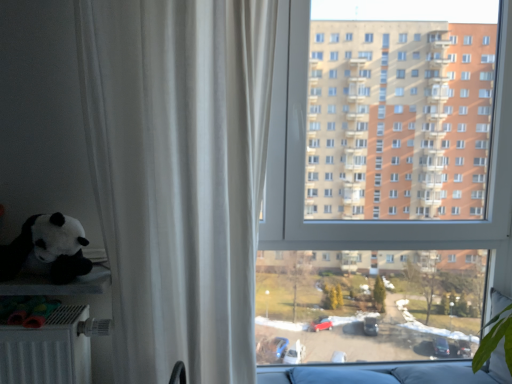
Question: From the image's perspective, is white sheer curtain at left under matte black plush panda at left?

Choices:
 (A) yes
 (B) no

Answer: (B)

Question: Can you confirm if white sheer curtain at left is bigger than matte black plush panda at left?

Choices:
 (A) yes
 (B) no

Answer: (A)

Question: Is white sheer curtain at left directly adjacent to matte black plush panda at left?

Choices:
 (A) no
 (B) yes

Answer: (A)

Question: Is white sheer curtain at left to the left of matte black plush panda at left from the viewer's perspective?

Choices:
 (A) yes
 (B) no

Answer: (B)

Question: Can we say white sheer curtain at left lies outside matte black plush panda at left?

Choices:
 (A) yes
 (B) no

Answer: (A)

Question: Considering the positions of white sheer curtain at left and matte black plush panda at left in the image, is white sheer curtain at left taller or shorter than matte black plush panda at left?

Choices:
 (A) tall
 (B) short

Answer: (A)

Question: Looking at the image, does white sheer curtain at left seem bigger or smaller compared to matte black plush panda at left?

Choices:
 (A) big
 (B) small

Answer: (A)

Question: Is white sheer curtain at left inside or outside of matte black plush panda at left?

Choices:
 (A) outside
 (B) inside

Answer: (A)

Question: From the image's perspective, relative to matte black plush panda at left, is white sheer curtain at left above or below?

Choices:
 (A) above
 (B) below

Answer: (A)

Question: From the image's perspective, is matte black plush panda at left located above or below white sheer curtain at left?

Choices:
 (A) below
 (B) above

Answer: (A)

Question: From a real-world perspective, is matte black plush panda at left physically located above or below white sheer curtain at left?

Choices:
 (A) above
 (B) below

Answer: (B)

Question: Is matte black plush panda at left taller or shorter than white sheer curtain at left?

Choices:
 (A) short
 (B) tall

Answer: (A)

Question: Based on their positions, is matte black plush panda at left located to the left or right of white sheer curtain at left?

Choices:
 (A) left
 (B) right

Answer: (A)

Question: Looking at their shapes, would you say transparent glass window at center is wider or thinner than matte black plush panda at left?

Choices:
 (A) thin
 (B) wide

Answer: (A)

Question: From the image's perspective, is transparent glass window at center positioned above or below matte black plush panda at left?

Choices:
 (A) above
 (B) below

Answer: (A)